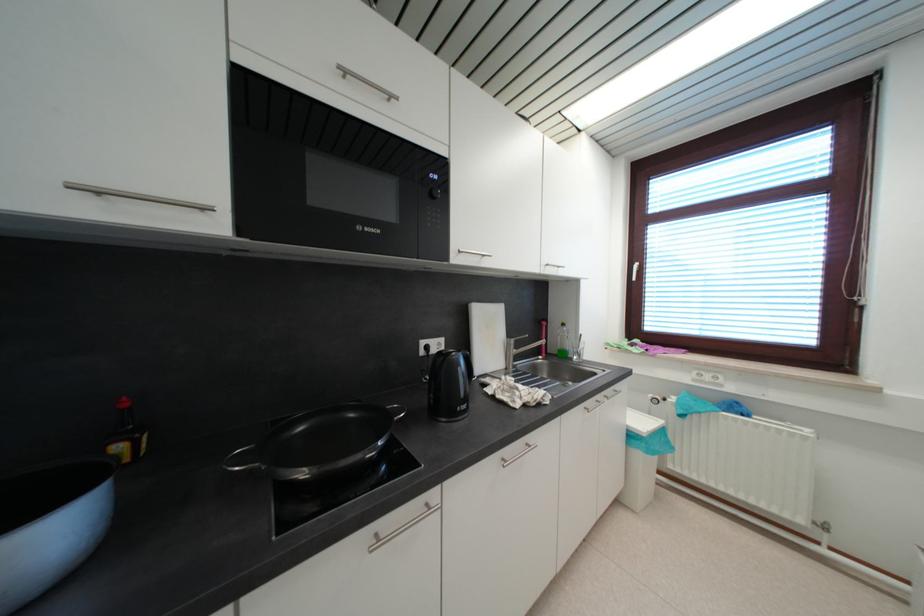
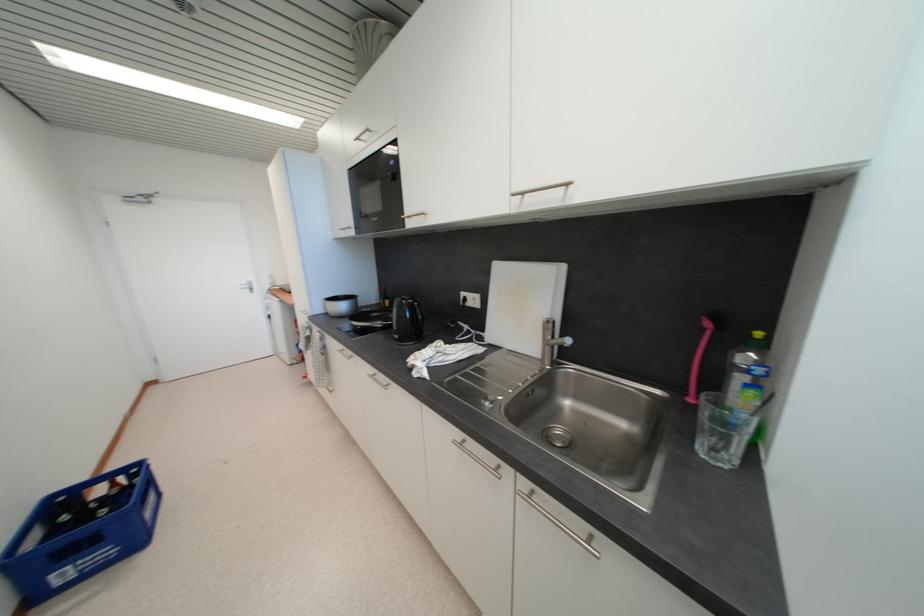
Where in the second image is the point corresponding to point (550, 326) from the first image?

(713, 326)